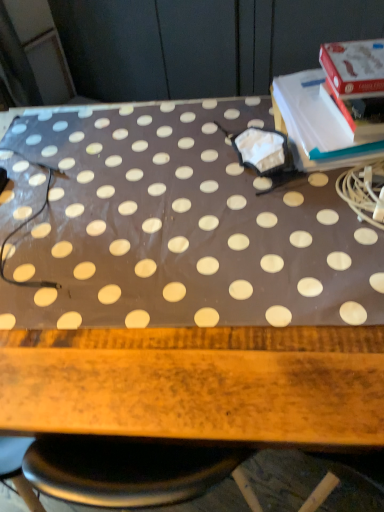
Find the location of a particular element. white polka dot fabric at center is located at coordinates (191, 291).

Describe the element at coordinates (191, 291) in the screenshot. The image size is (384, 512). I see `white polka dot fabric at center` at that location.

Measure the distance between white paper at upper right and camera.

white paper at upper right and camera are 84.00 centimeters apart from each other.

Locate an element on the screen. The width and height of the screenshot is (384, 512). white paper at upper right is located at coordinates (316, 123).

This screenshot has width=384, height=512. Describe the element at coordinates (316, 123) in the screenshot. I see `white paper at upper right` at that location.

The height and width of the screenshot is (512, 384). In order to click on white polka dot fabric at center in this screenshot , I will do `click(191, 291)`.

Which object is positioned more to the right, white paper at upper right or white polka dot fabric at center?

From the viewer's perspective, white paper at upper right appears more on the right side.

Is white paper at upper right closer to camera compared to white polka dot fabric at center?

That is False.

Which is farther from the camera, (329, 131) or (87, 318)?

The point (329, 131) is farther.

From the image's perspective, is white paper at upper right located above white polka dot fabric at center?

Yes.

From a real-world perspective, is white paper at upper right on white polka dot fabric at center?

Yes, from a real-world perspective, white paper at upper right is on top of white polka dot fabric at center.

Looking at their sizes, would you say white paper at upper right is wider or thinner than white polka dot fabric at center?

In the image, white paper at upper right appears to be more narrow than white polka dot fabric at center.

Is white paper at upper right taller than white polka dot fabric at center?

No.

Does white paper at upper right have a smaller size compared to white polka dot fabric at center?

Yes.

Is white paper at upper right completely or partially outside of white polka dot fabric at center?

That's correct, white paper at upper right is outside of white polka dot fabric at center.

Is white paper at upper right next to white polka dot fabric at center and touching it?

No, white paper at upper right is not in contact with white polka dot fabric at center.

Consider the image. Is white paper at upper right facing away from white polka dot fabric at center?

That's not correct — white paper at upper right is not looking away from white polka dot fabric at center.

Locate an element on the screen. This screenshot has width=384, height=512. paperback book on the right of the white polka dot fabric at center is located at coordinates (316, 123).

Which object is positioned more to the right, white polka dot fabric at center or white paper at upper right?

Positioned to the right is white paper at upper right.

Considering their positions, is white polka dot fabric at center located in front of or behind white paper at upper right?

Visually, white polka dot fabric at center is located in front of white paper at upper right.

Is point (100, 334) in front of point (344, 135)?

Yes, point (100, 334) is in front of point (344, 135).

From the image's perspective, is white polka dot fabric at center positioned above or below white paper at upper right?

From the image's perspective, white polka dot fabric at center appears below white paper at upper right.

From a real-world perspective, which object rests below the other?

From a 3D spatial view, white polka dot fabric at center is below.

Which of these two, white polka dot fabric at center or white paper at upper right, is wider?

white polka dot fabric at center is wider.

Considering the sizes of white polka dot fabric at center and white paper at upper right in the image, is white polka dot fabric at center taller or shorter than white paper at upper right?

In the image, white polka dot fabric at center appears to be taller than white paper at upper right.

Which of these two, white polka dot fabric at center or white paper at upper right, is bigger?

With larger size is white polka dot fabric at center.

Can we say white polka dot fabric at center lies outside white paper at upper right?

Yes, white polka dot fabric at center is outside of white paper at upper right.

Is white polka dot fabric at center next to white paper at upper right and touching it?

They are not placed beside each other.

Is white polka dot fabric at center positioned with its back to white paper at upper right?

No, white paper at upper right is not at the back of white polka dot fabric at center.

Can you tell me how much white polka dot fabric at center and white paper at upper right differ in facing direction?

4.19 degrees.

How far apart are white polka dot fabric at center and white paper at upper right?

A distance of 11.82 inches exists between white polka dot fabric at center and white paper at upper right.

The height and width of the screenshot is (512, 384). Identify the location of paperback book on the right of white polka dot fabric at center. (316, 123).

You are a GUI agent. You are given a task and a screenshot of the screen. Output one action in this format:
    pyautogui.click(x=<x>, y=<y>)
    Task: Click on the paperback book above the white polka dot fabric at center (from a real-world perspective)
    
    Given the screenshot: What is the action you would take?
    pyautogui.click(x=316, y=123)

At what (x,y) coordinates should I click in order to perform the action: click on table directly beneath the white paper at upper right (from a real-world perspective). Please return your answer as a coordinate pair (x, y). Looking at the image, I should click on (191, 291).